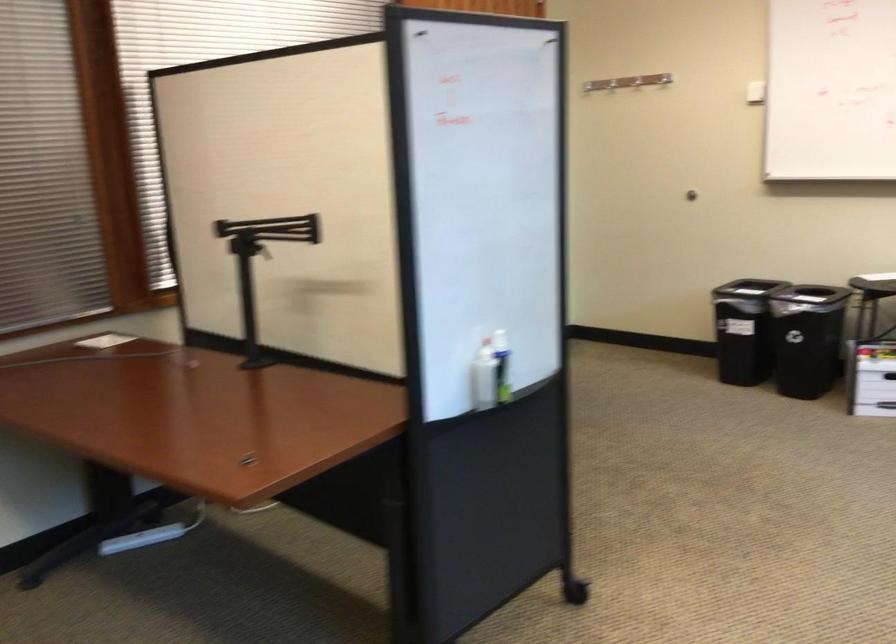
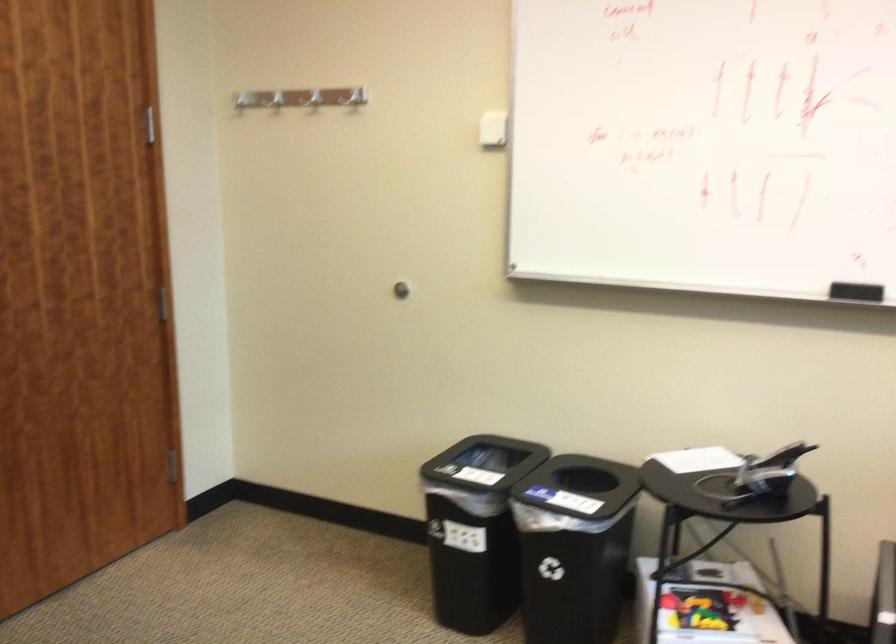
Find the pixel in the second image that matches [583,79] in the first image.

(352, 97)